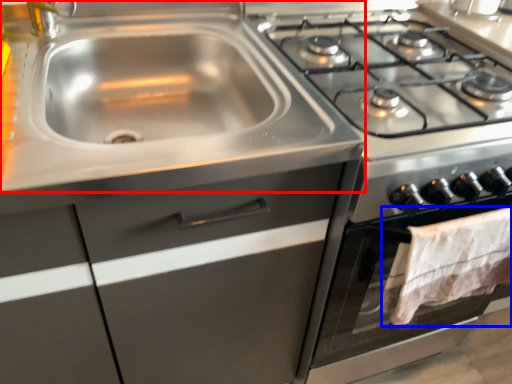
Question: Among these objects, which one is nearest to the camera, sink (highlighted by a red box) or blanket (highlighted by a blue box)?

Choices:
 (A) sink
 (B) blanket

Answer: (A)